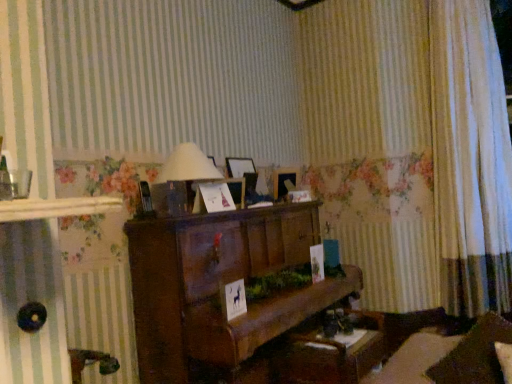
This screenshot has width=512, height=384. What do you see at coordinates (470, 159) in the screenshot? I see `white sheer curtain at right` at bounding box center [470, 159].

Describe the element at coordinates (220, 290) in the screenshot. I see `wooden piano at center` at that location.

I want to click on matte white lampshade at center, so tap(181, 179).

I want to click on wooden table at lower center, so click(333, 355).

The height and width of the screenshot is (384, 512). In order to click on white sheer curtain at right in this screenshot , I will do `click(470, 159)`.

From a real-world perspective, is white sheer curtain at right on top of wooden table at lower center?

Indeed, from a real-world perspective, white sheer curtain at right stands above wooden table at lower center.

Image resolution: width=512 pixels, height=384 pixels. I want to click on table on the left of white sheer curtain at right, so click(333, 355).

How different are the orientations of matte white lampshade at center and wooden table at lower center in degrees?

175 degrees.

Is matte white lampshade at center aimed at wooden table at lower center?

No.

Is the surface of matte white lampshade at center in direct contact with wooden table at lower center?

No, matte white lampshade at center is not beside wooden table at lower center.

Is matte white lampshade at center located outside wooden table at lower center?

Yes, matte white lampshade at center is not within wooden table at lower center.

Considering the points (357, 288) and (450, 50), which point is behind, point (357, 288) or point (450, 50)?

The point (450, 50) is behind.

In the scene shown: Considering the positions of objects wooden piano at center and white sheer curtain at right in the image provided, who is behind, wooden piano at center or white sheer curtain at right?

Positioned behind is white sheer curtain at right.

Based on the photo, measure the distance between wooden piano at center and white sheer curtain at right.

1.54 meters.

The image size is (512, 384). Find the location of `curtain behind the wooden piano at center`. curtain behind the wooden piano at center is located at coordinates (470, 159).

Is wooden table at lower center to the left of white sheer curtain at right from the viewer's perspective?

Indeed, wooden table at lower center is positioned on the left side of white sheer curtain at right.

Between wooden table at lower center and white sheer curtain at right, which one has larger width?

Wider between the two is wooden table at lower center.

From the image's perspective, relative to white sheer curtain at right, is wooden table at lower center above or below?

wooden table at lower center is situated lower than white sheer curtain at right in the image.

Which of these two, wooden table at lower center or white sheer curtain at right, is bigger?

Bigger between the two is white sheer curtain at right.

Does matte white lampshade at center turn towards wooden piano at center?

No, matte white lampshade at center is not turned towards wooden piano at center.

From the image's perspective, is matte white lampshade at center positioned above or below wooden piano at center?

Based on their image positions, matte white lampshade at center is located above wooden piano at center.

Locate an element on the screen. The image size is (512, 384). furniture in front of the matte white lampshade at center is located at coordinates (220, 290).

How different are the orientations of matte white lampshade at center and wooden piano at center in degrees?

There is a 0.604-degree angle between the facing directions of matte white lampshade at center and wooden piano at center.

Considering the sizes of objects wooden piano at center and wooden table at lower center in the image provided, who is wider, wooden piano at center or wooden table at lower center?

With larger width is wooden piano at center.

Is wooden piano at center oriented towards wooden table at lower center?

Yes, wooden piano at center is turned towards wooden table at lower center.

Considering the sizes of objects wooden piano at center and wooden table at lower center in the image provided, who is bigger, wooden piano at center or wooden table at lower center?

With larger size is wooden piano at center.

Between point (297, 320) and point (354, 340), which one is positioned in front?

Point (354, 340)

Does white sheer curtain at right have a larger size compared to wooden piano at center?

No, white sheer curtain at right is not bigger than wooden piano at center.

Are white sheer curtain at right and wooden piano at center far apart?

Yes, white sheer curtain at right and wooden piano at center are located far from each other.

Who is taller, white sheer curtain at right or wooden piano at center?

Standing taller between the two is white sheer curtain at right.

Identify the location of curtain on the right of wooden table at lower center. The width and height of the screenshot is (512, 384). (470, 159).

Locate an element on the screen. This screenshot has height=384, width=512. table located in front of the matte white lampshade at center is located at coordinates (333, 355).

Based on their spatial positions, is matte white lampshade at center or wooden piano at center closer to wooden table at lower center?

Based on the image, wooden piano at center appears to be nearer to wooden table at lower center.

Considering their positions, is matte white lampshade at center positioned further to wooden table at lower center than white sheer curtain at right?

white sheer curtain at right is further to wooden table at lower center.

From the picture: Which object lies further to the anchor point wooden table at lower center, wooden piano at center or matte white lampshade at center?

Based on the image, matte white lampshade at center appears to be further to wooden table at lower center.

When comparing their distances from wooden piano at center, does wooden table at lower center or white sheer curtain at right seem closer?

Based on the image, wooden table at lower center appears to be nearer to wooden piano at center.

Which object lies nearer to the anchor point white sheer curtain at right, wooden piano at center or wooden table at lower center?

Based on the image, wooden table at lower center appears to be nearer to white sheer curtain at right.

Which object lies nearer to the anchor point white sheer curtain at right, matte white lampshade at center or wooden table at lower center?

wooden table at lower center is positioned closer to the anchor white sheer curtain at right.

Which object lies further to the anchor point white sheer curtain at right, wooden table at lower center or matte white lampshade at center?

matte white lampshade at center is positioned further to the anchor white sheer curtain at right.

Looking at the image, which one is located further to matte white lampshade at center, wooden table at lower center or white sheer curtain at right?

white sheer curtain at right lies further to matte white lampshade at center than the other object.

Identify the location of furniture between matte white lampshade at center and wooden table at lower center from top to bottom. (220, 290).

At what (x,y) coordinates should I click in order to perform the action: click on table situated between matte white lampshade at center and white sheer curtain at right from left to right. Please return your answer as a coordinate pair (x, y). Looking at the image, I should click on (333, 355).

Locate an element on the screen. This screenshot has width=512, height=384. furniture located between matte white lampshade at center and white sheer curtain at right in the left-right direction is located at coordinates (220, 290).

Identify the location of table between wooden piano at center and white sheer curtain at right from left to right. (333, 355).